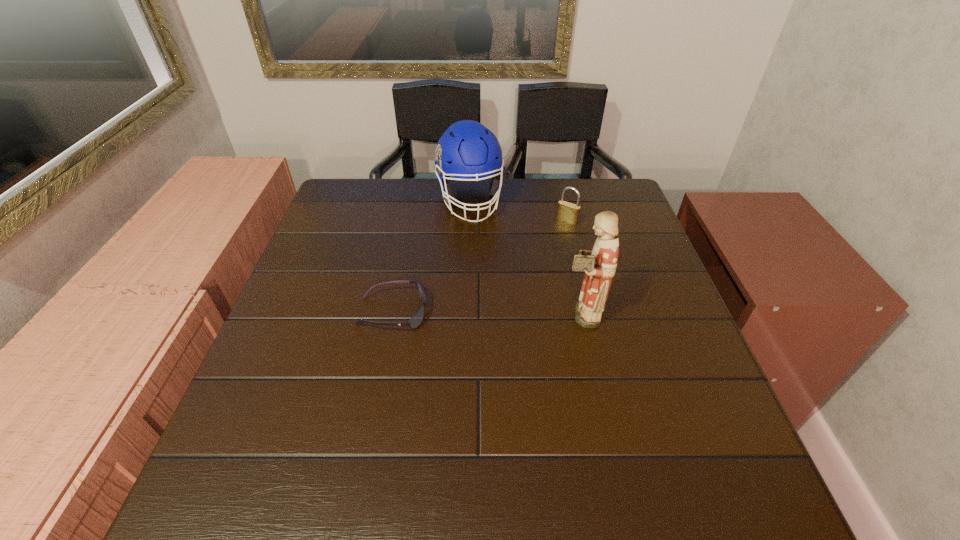
I want to click on the shortest object, so click(x=415, y=321).

The height and width of the screenshot is (540, 960). I want to click on figurine, so click(x=599, y=265).

The image size is (960, 540). Identify the location of padlock. (567, 212).

Find the location of a particular element. The height and width of the screenshot is (540, 960). football helmet is located at coordinates (467, 150).

The height and width of the screenshot is (540, 960). In order to click on free spot located on the lenses of the shortest object in this screenshot , I will do `click(461, 313)`.

Image resolution: width=960 pixels, height=540 pixels. In order to click on vacant region located on the front-facing side of the figurine in this screenshot , I will do (x=405, y=314).

Where is `vacant space located on the front-facing side of the figurine`? The image size is (960, 540). vacant space located on the front-facing side of the figurine is located at coordinates pyautogui.click(x=517, y=314).

This screenshot has height=540, width=960. I want to click on free location located on the front-facing side of the figurine, so click(x=540, y=314).

Where is `free space located on the front-facing side of the third tallest object`? The height and width of the screenshot is (540, 960). free space located on the front-facing side of the third tallest object is located at coordinates (500, 300).

At what (x,y) coordinates should I click in order to perform the action: click on blank area located 0.250m on the front-facing side of the third tallest object. Please return your answer as a coordinate pair (x, y). Image resolution: width=960 pixels, height=540 pixels. Looking at the image, I should click on (521, 274).